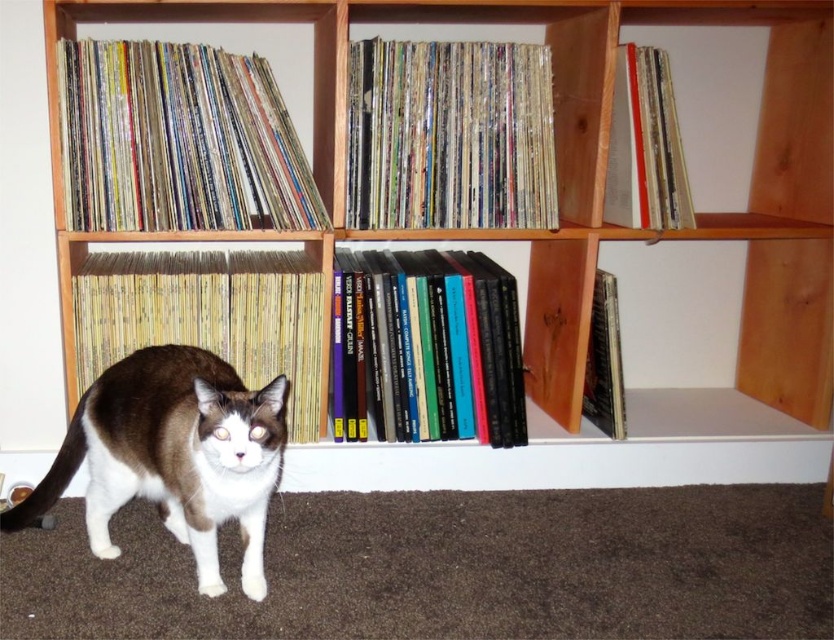
Question: Is wooden bookcase at center positioned at the back of yellow paperbacks at left?

Choices:
 (A) no
 (B) yes

Answer: (A)

Question: Which is nearer to the brown and white fur cat at center?

Choices:
 (A) multicolored paper records at upper left
 (B) yellow paperbacks at left

Answer: (B)

Question: Is brown and white fur cat at center in front of hardcover book at center?

Choices:
 (A) no
 (B) yes

Answer: (B)

Question: Considering the real-world distances, which object is closest to the yellow paperbacks at left?

Choices:
 (A) multicolored vinyl records at center
 (B) hardcover books at center
 (C) hardcover book at center

Answer: (B)

Question: Among these points, which one is farthest from the camera?

Choices:
 (A) [x=656, y=138]
 (B) [x=516, y=99]
 (C) [x=413, y=426]

Answer: (C)

Question: Considering the relative positions of hardcover books at center and yellow paperbacks at left in the image provided, where is hardcover books at center located with respect to yellow paperbacks at left?

Choices:
 (A) left
 (B) right

Answer: (B)